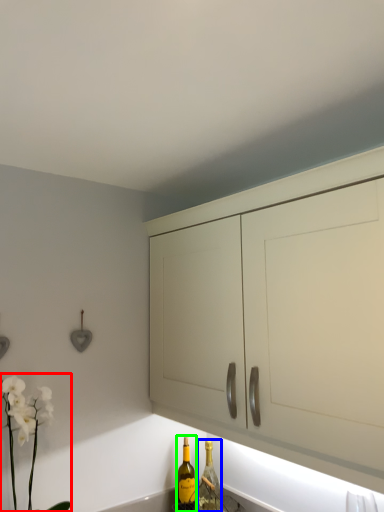
Question: Based on their relative distances, which object is nearer to floral arrangement (highlighted by a red box)? Choose from bottle (highlighted by a blue box) and bottle (highlighted by a green box).

Choices:
 (A) bottle
 (B) bottle

Answer: (B)